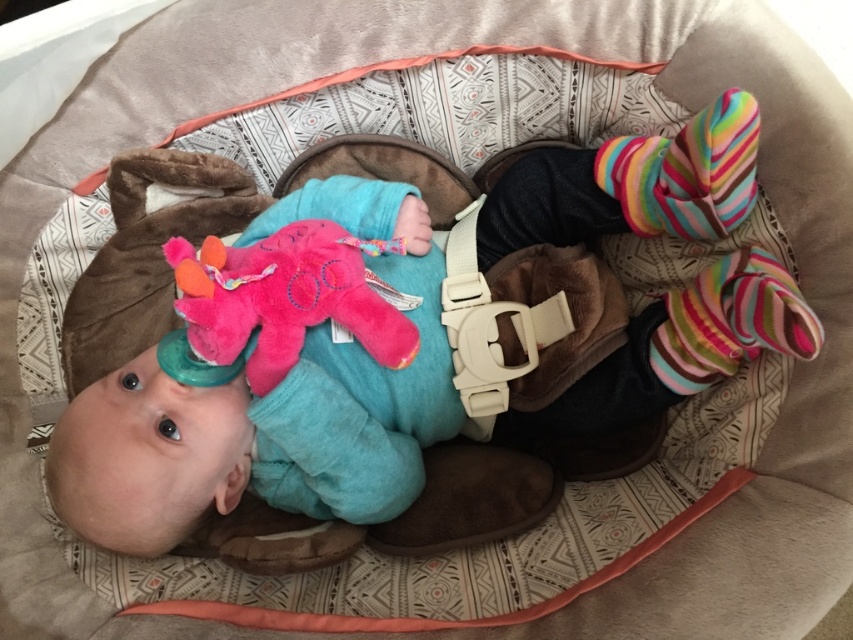
You are a photographer setting up a shoot inside the baby playpen. You need to position a small prop between the multicolored fuzzy socks at upper right and the multicolored striped sock at right. Based on their positions, which sock should the prop be placed closer to?

The multicolored striped sock at right is behind the multicolored fuzzy socks at upper right, so the prop should be placed closer to the multicolored fuzzy socks at upper right to ensure visibility from the front.

You are a parent checking on your baby in the playpen. You notice the multicolored striped sock at right and the pink plush toy at center. Which object is closer to you?

The multicolored striped sock at right is behind the pink plush toy at center, so the pink plush toy at center is closer to you.

You are a parent trying to place a small toy between the pink plush toy at center and the multicolored striped sock at right. Which object should you place the new toy closer to if you want it to be taller than both?

The pink plush toy at center is taller than the multicolored striped sock at right. To have the new toy taller than both, place it closer to the pink plush toy at center since it already has the greater height.